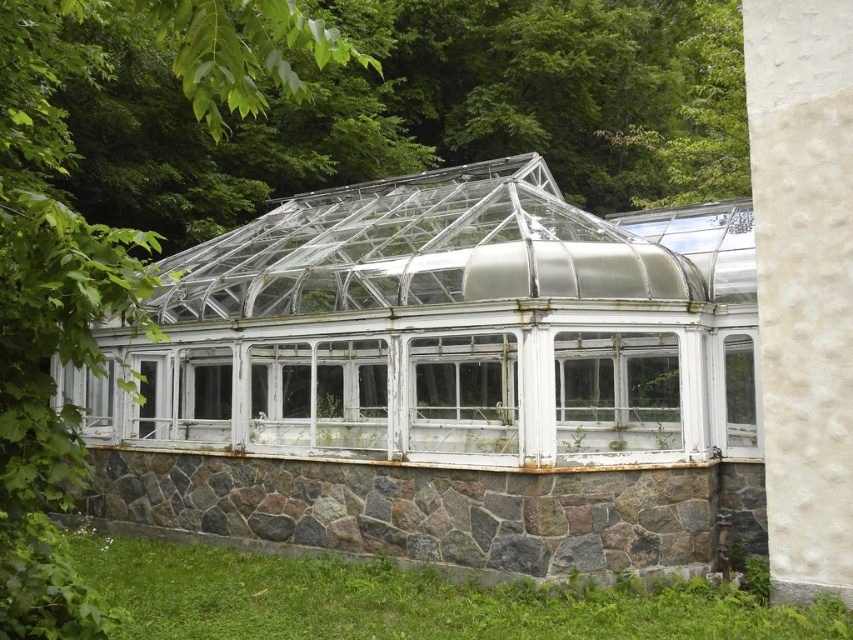
Question: Which point is farther to the camera?

Choices:
 (A) (267, 435)
 (B) (155, 561)
 (C) (427, 385)
 (D) (583, 424)

Answer: (C)

Question: Does green grass at lower left appear over transparent glass window at center?

Choices:
 (A) no
 (B) yes

Answer: (A)

Question: Among these points, which one is farthest from the camera?

Choices:
 (A) (494, 451)
 (B) (670, 419)
 (C) (374, 368)

Answer: (C)

Question: Is green grass at lower left positioned in front of white textured glass window at center?

Choices:
 (A) no
 (B) yes

Answer: (B)

Question: Among these objects, which one is nearest to the camera?

Choices:
 (A) white textured glass window at center
 (B) green grass at lower left
 (C) transparent glass window at center

Answer: (B)

Question: Can you confirm if white wooden window at center is smaller than white textured glass window at center?

Choices:
 (A) yes
 (B) no

Answer: (B)